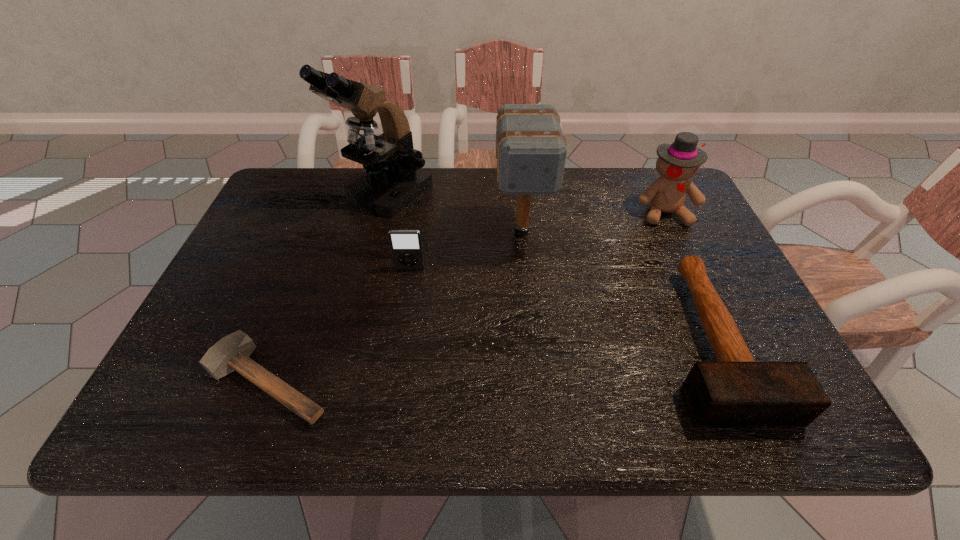
In order to click on the tallest object in this screenshot , I will do `click(394, 177)`.

At what (x,y) coordinates should I click in order to perform the action: click on the second mallet from left to right. Please return your answer as a coordinate pair (x, y). Looking at the image, I should click on (x=531, y=150).

Identify the location of the farthest mallet. This screenshot has height=540, width=960. (531, 150).

Locate an element on the screen. the fourth shortest object is located at coordinates (677, 162).

Identify the location of the fourth farthest object. This screenshot has width=960, height=540. (406, 246).

I want to click on iPod, so click(x=406, y=246).

This screenshot has height=540, width=960. Find the location of `the second shortest mallet`. the second shortest mallet is located at coordinates (736, 391).

At what (x,y) coordinates should I click in order to perform the action: click on the rightmost mallet. Please return your answer as a coordinate pair (x, y). The height and width of the screenshot is (540, 960). Looking at the image, I should click on (736, 391).

This screenshot has height=540, width=960. I want to click on the leftmost mallet, so click(x=232, y=352).

Locate an element on the screen. the shortest mallet is located at coordinates (232, 352).